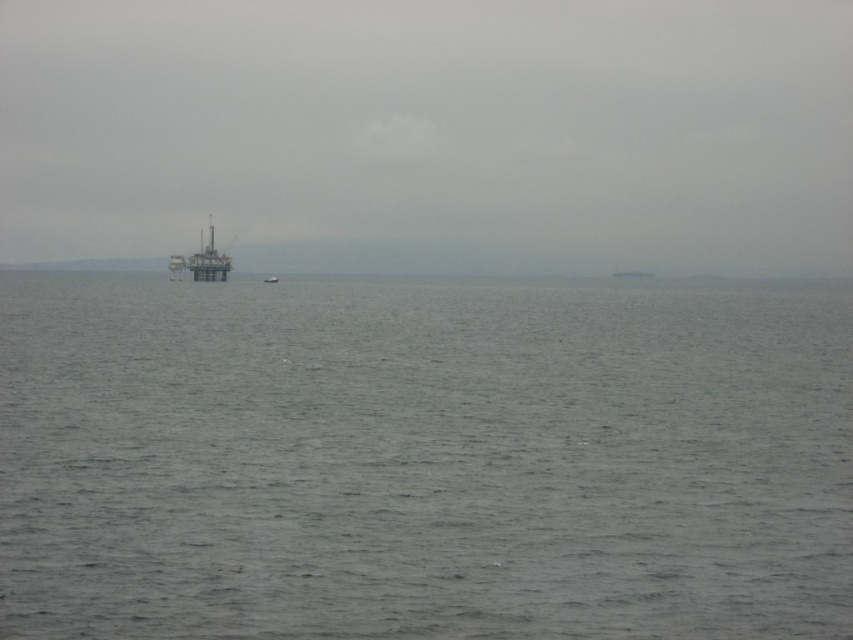
You are a sailor on the gray matte boat at center and want to reach the metallic gray platform at center to deliver supplies. Is the platform accessible from your current position?

The metallic gray platform at center is above the gray matte boat at center, so the boat cannot reach the platform directly since it is positioned higher up.

You are a sailor trying to navigate between the gray matte boat at center and the white plastic boat at center. Which boat should you steer towards if you want to move to the right side of the image?

You should steer towards the gray matte boat at center because it is positioned to the right of the white plastic boat at center, so moving towards it would take you further to the right side of the image.

Based on the photo, you are standing on the deck of a ship and see the gray matte boat at center and the white plastic boat at center. Which boat is closer to you?

The gray matte boat at center is closer to you because it is positioned further to the viewer than the white plastic boat at center.